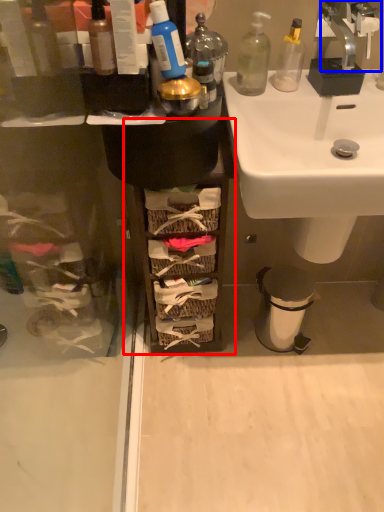
Question: Which point is further to the camera, cabinetry (highlighted by a red box) or tap (highlighted by a blue box)?

Choices:
 (A) cabinetry
 (B) tap

Answer: (A)